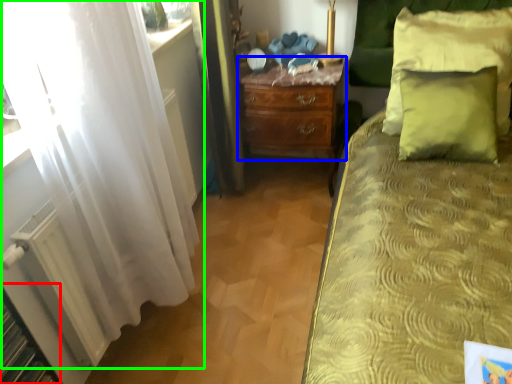
Question: Considering the real-world distances, which object is farthest from shelf (highlighted by a red box)? nightstand (highlighted by a blue box) or curtain (highlighted by a green box)?

Choices:
 (A) nightstand
 (B) curtain

Answer: (A)